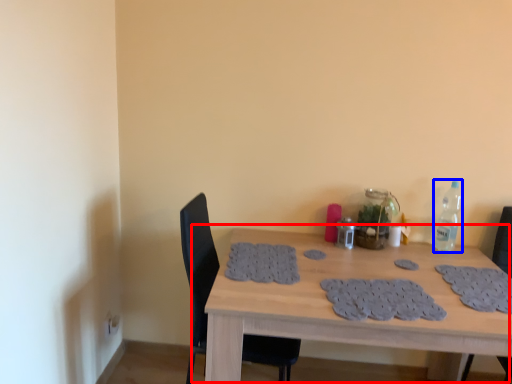
Question: Which object is further to the camera taking this photo, table (highlighted by a red box) or bottle (highlighted by a blue box)?

Choices:
 (A) table
 (B) bottle

Answer: (B)